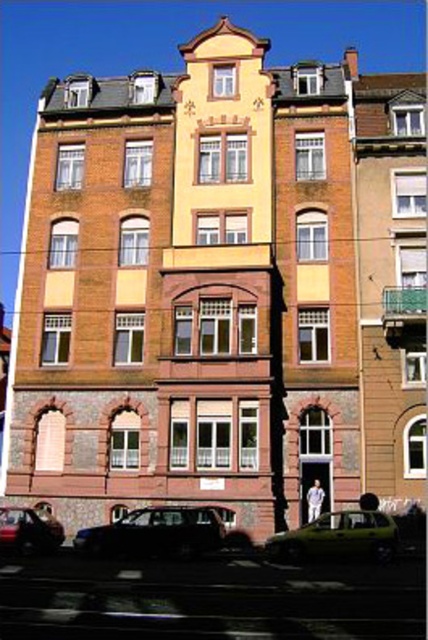
You are standing at the entrance of the multi story residential building and want to park your car at the shiny black car at lower center. What are the coordinates of the parking spot?

The coordinates of the parking spot for the shiny black car at lower center are at point [154,532].

You are a delivery driver who needs to park your green matte car at center in a parking spot marked by point (338, 538). Can you safely park your car there?

The point (338, 538) is on the green matte car at center, so the car is already parked at that location.

You are a delivery person standing at the shiny black car at lower left. You need to reach the shiny black car at lower center to drop off a package. Given that your delivery cart is 6 feet wide, can you navigate through the space between the two cars?

The distance between the shiny black car at lower center and the shiny black car at lower left is 17.21 feet. Since the delivery cart is 6 feet wide, there is sufficient space to navigate between them as 17.21 feet is greater than 6 feet.